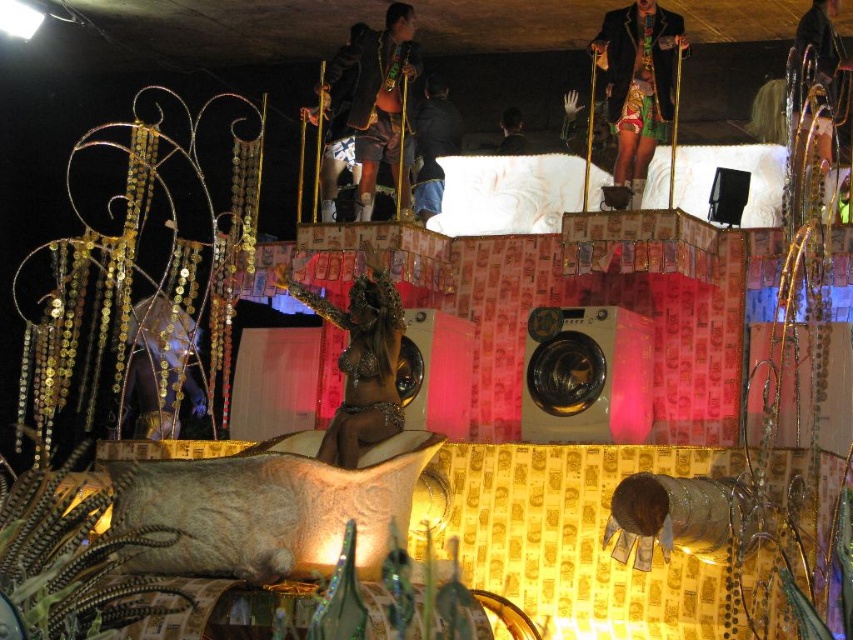
You are an audience member sitting in the front row of the stage. You see the shiny gold statue at center and the dark blue jeans at center. Which object is closer to you?

The shiny gold statue at center is closer to you because it is in front of the dark blue jeans at center.

You are a stagehand preparing to move the shiny gold statue at center and the dark blue jeans at center off the stage. Given the size difference between them, which object will require more effort to lift?

The shiny gold statue at center is larger in size than the dark blue jeans at center, so it will require more effort to lift.